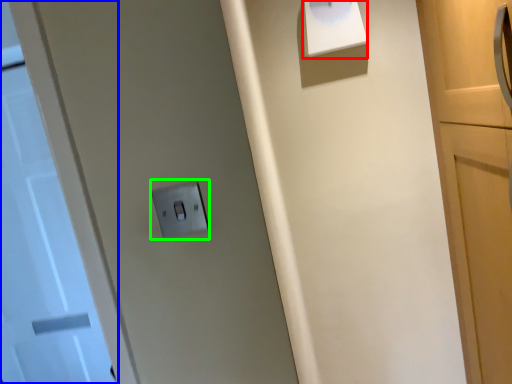
Question: Based on their relative distances, which object is farther from wide (highlighted by a red box)? Choose from door (highlighted by a blue box) and light switch (highlighted by a green box).

Choices:
 (A) door
 (B) light switch

Answer: (A)